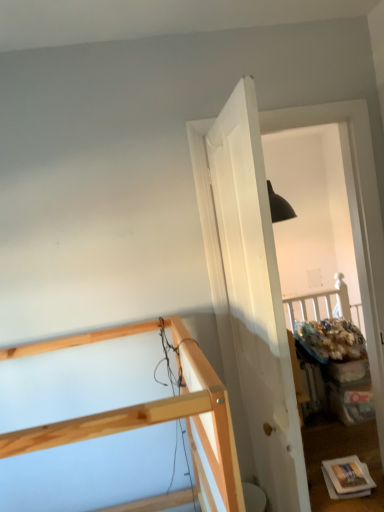
Question: From the image's perspective, is white matte door at center located above or below natural wood bunk bed at upper left?

Choices:
 (A) below
 (B) above

Answer: (B)

Question: Considering their positions, is white matte door at center located in front of or behind natural wood bunk bed at upper left?

Choices:
 (A) front
 (B) behind

Answer: (B)

Question: Is point (266, 498) positioned closer to the camera than point (69, 437)?

Choices:
 (A) farther
 (B) closer

Answer: (A)

Question: Considering the positions of point (38, 429) and point (253, 201), is point (38, 429) closer or farther from the camera than point (253, 201)?

Choices:
 (A) farther
 (B) closer

Answer: (B)

Question: Do you think natural wood bunk bed at upper left is within white matte door at center, or outside of it?

Choices:
 (A) outside
 (B) inside

Answer: (A)

Question: From the image's perspective, is natural wood bunk bed at upper left positioned above or below white matte door at center?

Choices:
 (A) below
 (B) above

Answer: (A)

Question: In terms of height, does natural wood bunk bed at upper left look taller or shorter compared to white matte door at center?

Choices:
 (A) tall
 (B) short

Answer: (B)